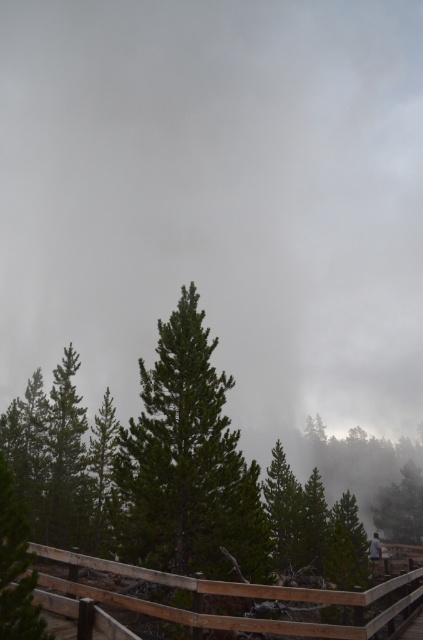
Image resolution: width=423 pixels, height=640 pixels. Describe the element at coordinates (16, 566) in the screenshot. I see `green matte tree at lower left` at that location.

Does green matte tree at lower left have a greater height compared to light gray fabric jacket at center?

Incorrect, green matte tree at lower left's height is not larger of light gray fabric jacket at center's.

Does point (2, 563) come behind point (376, 568)?

No, (2, 563) is in front of (376, 568).

I want to click on green matte tree at lower left, so click(x=16, y=566).

Can you confirm if green matte tree at center is positioned to the right of light gray fabric jacket at center?

No, green matte tree at center is not to the right of light gray fabric jacket at center.

Between green matte tree at center and light gray fabric jacket at center, which one is positioned higher?

green matte tree at center is higher up.

Does point (126, 513) lie behind point (381, 557)?

No, it is not.

This screenshot has width=423, height=640. What are the coordinates of `green matte tree at center` in the screenshot? It's located at click(x=187, y=461).

Can you confirm if green matte tree at center is smaller than green matte tree at lower left?

Actually, green matte tree at center might be larger than green matte tree at lower left.

Can you confirm if green matte tree at center is positioned to the left of green matte tree at lower left?

Correct, you'll find green matte tree at center to the left of green matte tree at lower left.

Looking at this image, who is more distant from viewer, (140, 365) or (13, 611)?

Point (140, 365)

This screenshot has width=423, height=640. I want to click on green matte tree at center, so click(187, 461).